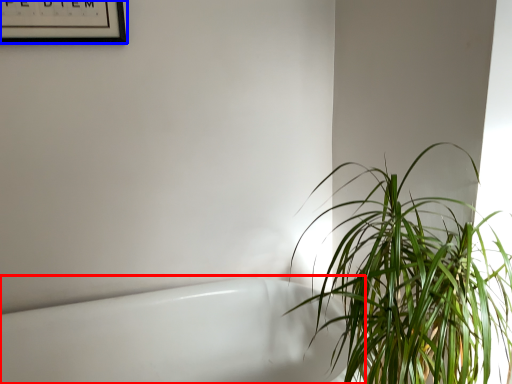
Question: Which object appears farthest to the camera in this image, bath (highlighted by a red box) or picture frame (highlighted by a blue box)?

Choices:
 (A) bath
 (B) picture frame

Answer: (B)